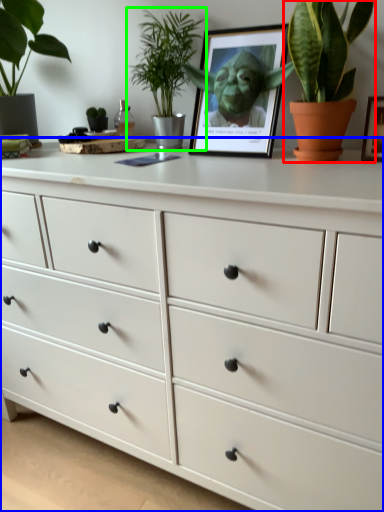
Question: Based on their relative distances, which object is farther from houseplant (highlighted by a red box)? Choose from chest of drawers (highlighted by a blue box) and houseplant (highlighted by a green box).

Choices:
 (A) chest of drawers
 (B) houseplant

Answer: (A)